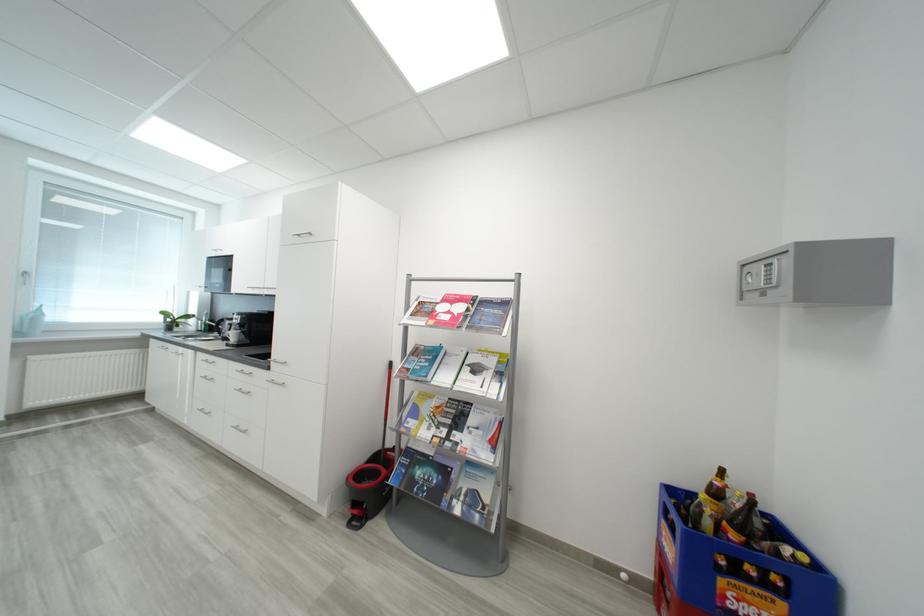
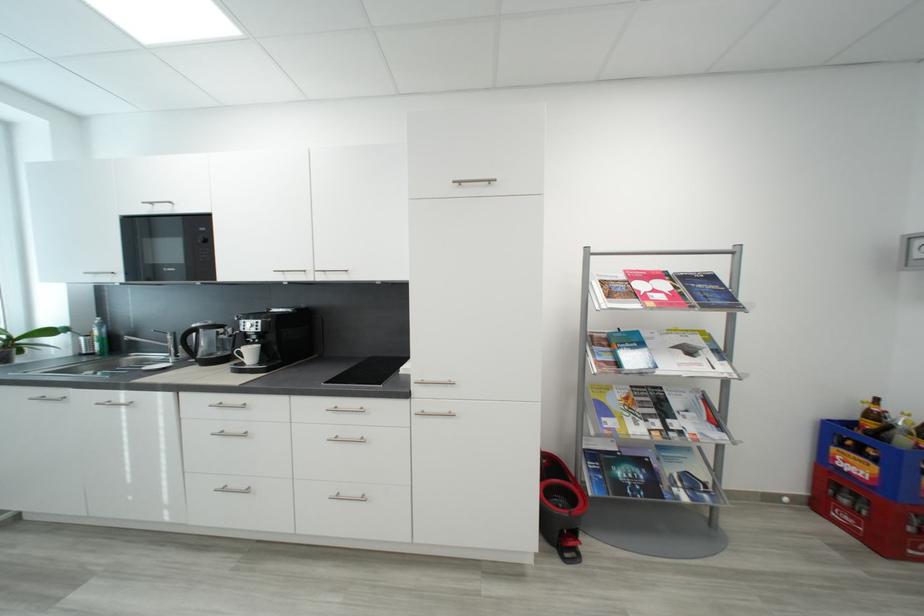
Locate, in the second image, the point that corresponds to (482,371) in the first image.

(697, 353)